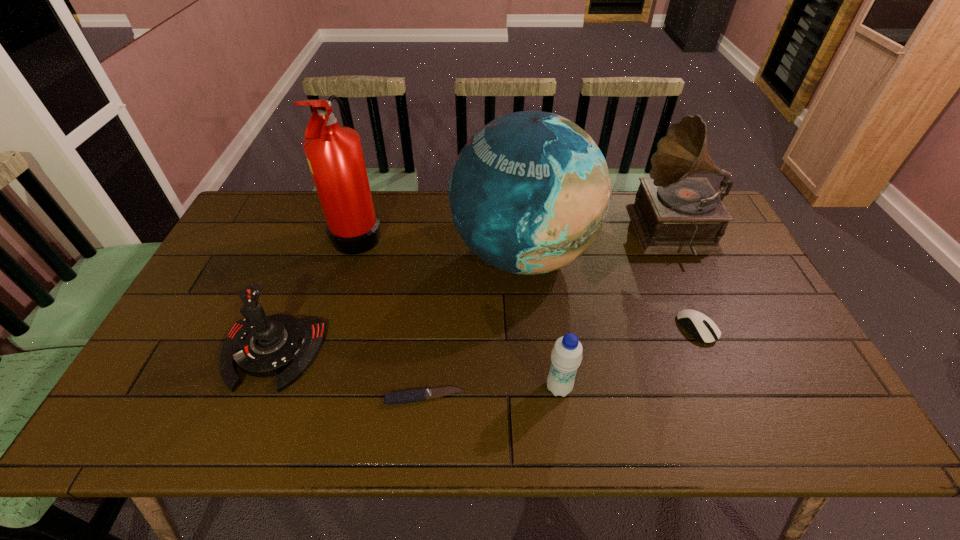
Find the location of a particular element. Image resolution: width=960 pixels, height=540 pixels. free area in between the third tallest object and the water bottle is located at coordinates (617, 311).

In order to click on free spot between the water bottle and the mouse in this screenshot , I will do `click(628, 358)`.

Where is `free space that is in between the fire extinguisher and the water bottle`? free space that is in between the fire extinguisher and the water bottle is located at coordinates (459, 310).

This screenshot has height=540, width=960. Find the location of `free point between the water bottle and the fire extinguisher`. free point between the water bottle and the fire extinguisher is located at coordinates (459, 310).

Where is `vacant point located between the joystick and the fire extinguisher`? The width and height of the screenshot is (960, 540). vacant point located between the joystick and the fire extinguisher is located at coordinates (315, 293).

Find the location of a particular element. This screenshot has width=960, height=540. vacant area that lies between the water bottle and the mouse is located at coordinates (628, 358).

Identify the location of vacant space that's between the joystick and the second shortest object. pos(485,341).

I want to click on unoccupied area between the globe and the water bottle, so click(541, 321).

Where is `the fifth closest object relative to the water bottle`? The image size is (960, 540). the fifth closest object relative to the water bottle is located at coordinates (262, 346).

Where is `the second closest object to the globe`? Image resolution: width=960 pixels, height=540 pixels. the second closest object to the globe is located at coordinates (702, 328).